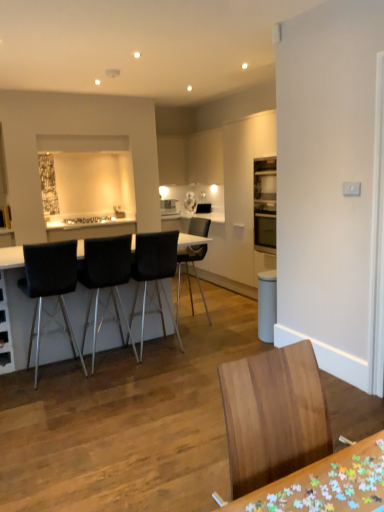
Where is `free space to the right of black leather chair at center, acting as the first chair starting from the back`? The width and height of the screenshot is (384, 512). free space to the right of black leather chair at center, acting as the first chair starting from the back is located at coordinates (236, 317).